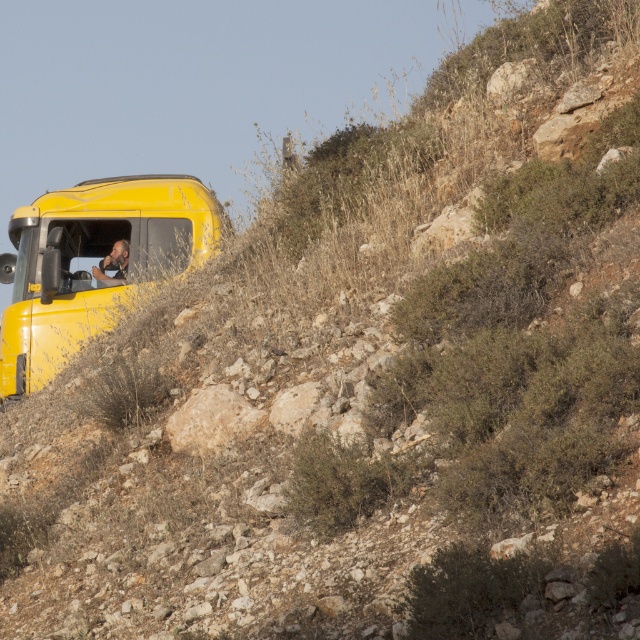
Is shiny yellow truck at upper left to the left of camouflage uniform at left from the viewer's perspective?

Correct, you'll find shiny yellow truck at upper left to the left of camouflage uniform at left.

Looking at this image, which of these two, shiny yellow truck at upper left or camouflage uniform at left, stands taller?

With more height is shiny yellow truck at upper left.

This screenshot has height=640, width=640. Identify the location of shiny yellow truck at upper left. (93, 262).